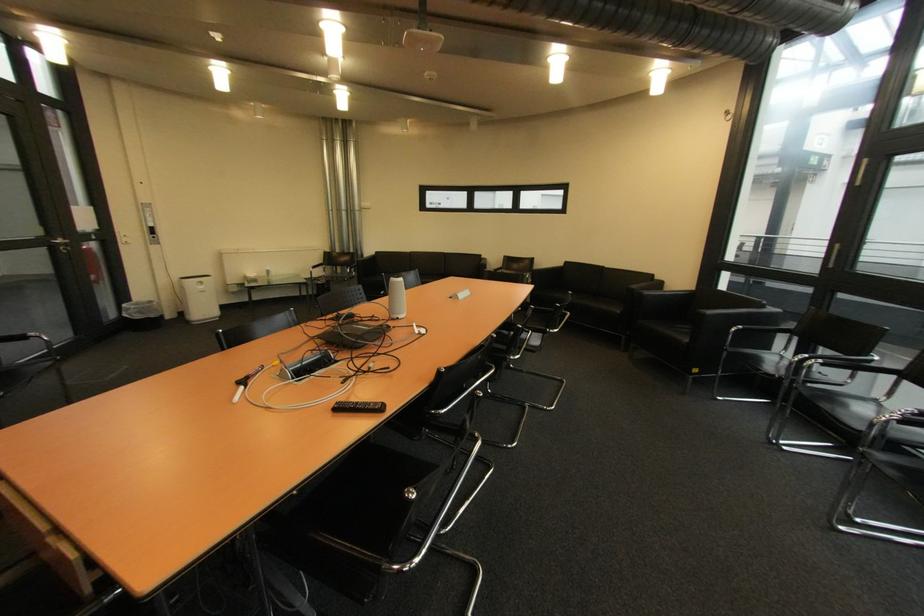
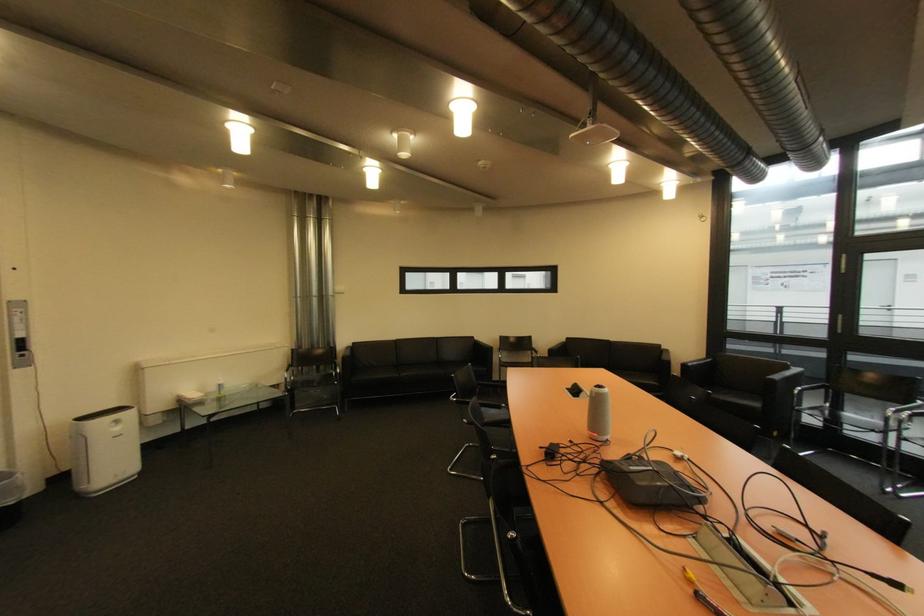
In a continuous first-person perspective shot, in which direction is the camera moving?

The cameraman walked toward left, forward.